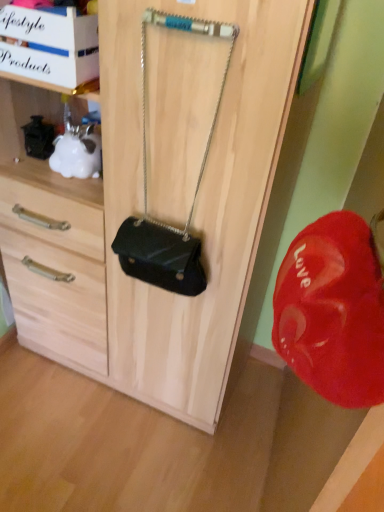
What do you see at coordinates (142, 212) in the screenshot? I see `matte black purse at center` at bounding box center [142, 212].

This screenshot has width=384, height=512. What are the coordinates of `matte black purse at center` in the screenshot? It's located at (142, 212).

The width and height of the screenshot is (384, 512). Find the location of `black leather handbag at center`. black leather handbag at center is located at coordinates (146, 193).

Describe the element at coordinates (146, 193) in the screenshot. This screenshot has height=512, width=384. I see `black leather handbag at center` at that location.

In order to click on matte black purse at center in this screenshot , I will do `click(142, 212)`.

Which is more to the right, matte black purse at center or black leather handbag at center?

Positioned to the right is black leather handbag at center.

Is matte black purse at center positioned before black leather handbag at center?

No, it is not.

Is point (186, 308) behind point (144, 193)?

Yes.

From the image's perspective, which object appears higher, matte black purse at center or black leather handbag at center?

black leather handbag at center.

From a real-world perspective, is matte black purse at center physically located above or below black leather handbag at center?

In terms of real-world spatial position, matte black purse at center is below black leather handbag at center.

Which of these two, matte black purse at center or black leather handbag at center, is thinner?

Thinner between the two is black leather handbag at center.

In terms of height, does matte black purse at center look taller or shorter compared to black leather handbag at center?

Clearly, matte black purse at center is taller compared to black leather handbag at center.

Between matte black purse at center and black leather handbag at center, which one has smaller size?

With smaller size is black leather handbag at center.

Is matte black purse at center located outside black leather handbag at center?

matte black purse at center lies outside black leather handbag at center's area.

Consider the image. Is matte black purse at center next to black leather handbag at center?

No, matte black purse at center is not next to black leather handbag at center.

Is black leather handbag at center at the back of matte black purse at center?

Yes, black leather handbag at center is at the back of matte black purse at center.

How different are the orientations of matte black purse at center and black leather handbag at center in degrees?

The facing directions of matte black purse at center and black leather handbag at center are 0.000722 degrees apart.

How much distance is there between matte black purse at center and black leather handbag at center?

matte black purse at center is 9.71 inches away from black leather handbag at center.

Image resolution: width=384 pixels, height=512 pixels. Find the location of `handbag in front of the matte black purse at center`. handbag in front of the matte black purse at center is located at coordinates (146, 193).

Considering the relative positions of black leather handbag at center and matte black purse at center in the image provided, is black leather handbag at center to the left or to the right of matte black purse at center?

black leather handbag at center is to the right of matte black purse at center.

In the image, is black leather handbag at center positioned in front of or behind matte black purse at center?

In the image, black leather handbag at center appears in front of matte black purse at center.

Is point (212, 131) farther from viewer compared to point (266, 199)?

No.

From the image's perspective, which object appears higher, black leather handbag at center or matte black purse at center?

black leather handbag at center is shown above in the image.

From a real-world perspective, between black leather handbag at center and matte black purse at center, who is vertically higher?

black leather handbag at center, from a real-world perspective.

Can you confirm if black leather handbag at center is thinner than matte black purse at center?

Indeed, black leather handbag at center has a lesser width compared to matte black purse at center.

Can you confirm if black leather handbag at center is shorter than matte black purse at center?

Yes.

Looking at this image, is black leather handbag at center smaller than matte black purse at center?

Correct, black leather handbag at center occupies less space than matte black purse at center.

Is black leather handbag at center surrounding matte black purse at center?

No, black leather handbag at center does not contain matte black purse at center.

Would you say black leather handbag at center is a long distance from matte black purse at center?

No, black leather handbag at center is not far from matte black purse at center.

Is matte black purse at center at the back of black leather handbag at center?

Yes.

What's the angular difference between black leather handbag at center and matte black purse at center's facing directions?

0.000722 degrees.

Find the location of `cabinetry that is below the black leather handbag at center (from the image's perspective)`. cabinetry that is below the black leather handbag at center (from the image's perspective) is located at coordinates (142, 212).

The height and width of the screenshot is (512, 384). Find the location of `cabinetry below the black leather handbag at center (from a real-world perspective)`. cabinetry below the black leather handbag at center (from a real-world perspective) is located at coordinates (142, 212).

Identify the location of handbag to the right of matte black purse at center. (146, 193).